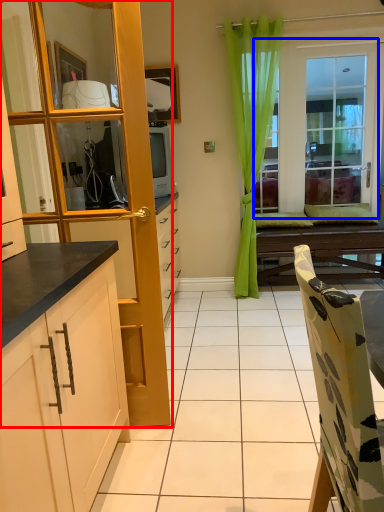
Question: Which point is further to the camera, cabinetry (highlighted by a red box) or window (highlighted by a blue box)?

Choices:
 (A) cabinetry
 (B) window

Answer: (B)